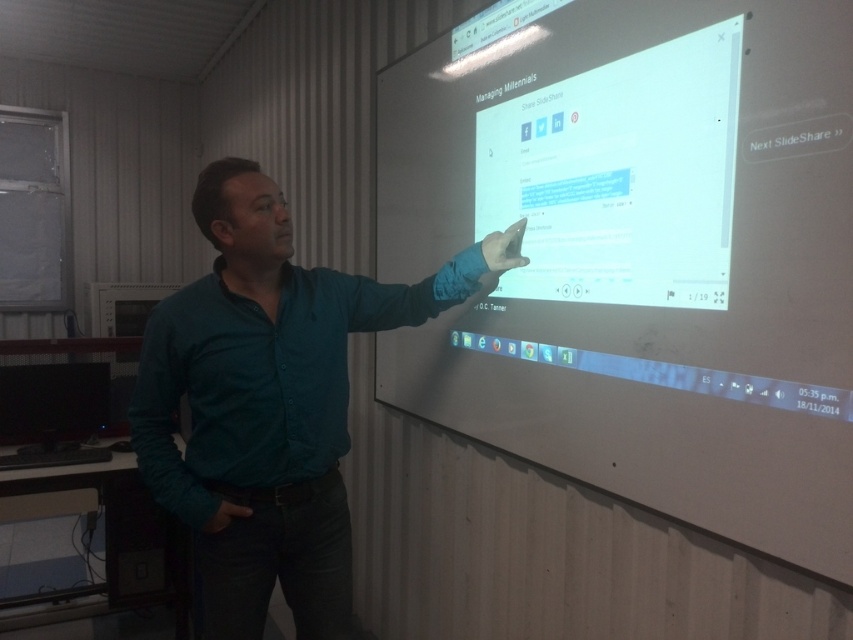
Can you confirm if white matte projection screen at center is positioned to the left of teal shirt at center?

No, white matte projection screen at center is not to the left of teal shirt at center.

In the scene shown: Who is shorter, white matte projection screen at center or teal shirt at center?

Standing shorter between the two is teal shirt at center.

Between point (433, 86) and point (259, 496), which one is positioned in front?

Point (259, 496)

The height and width of the screenshot is (640, 853). I want to click on white matte projection screen at center, so click(643, 257).